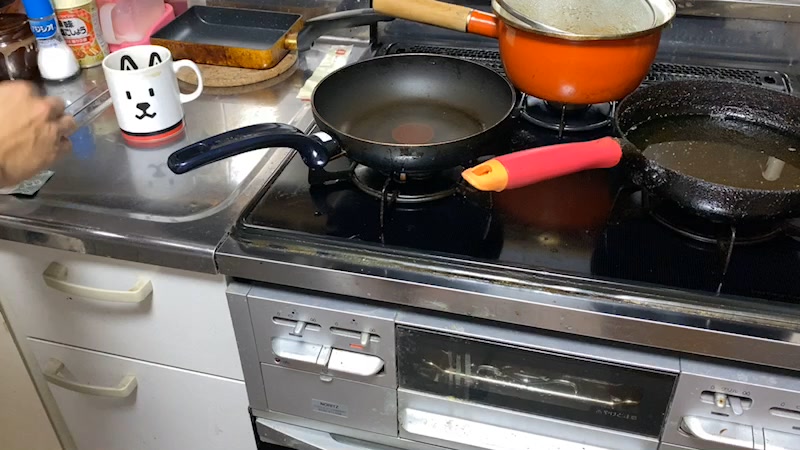
Locate an element on the screen. The width and height of the screenshot is (800, 450). orange pan is located at coordinates [564, 56].